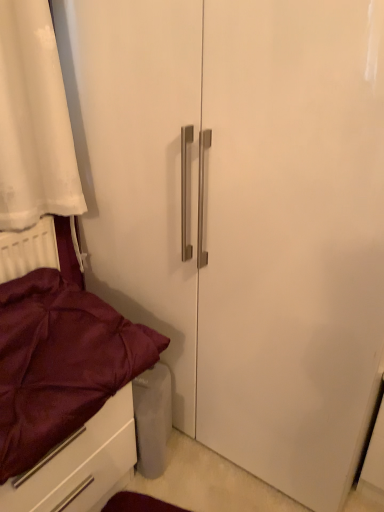
Locate an element on the screen. satin burgundy drawer at lower left is located at coordinates click(80, 464).

The image size is (384, 512). Describe the element at coordinates (80, 464) in the screenshot. I see `satin burgundy drawer at lower left` at that location.

Image resolution: width=384 pixels, height=512 pixels. In order to click on maroon satin bed at lower left in this screenshot , I will do `click(79, 464)`.

Describe the element at coordinates (79, 464) in the screenshot. The width and height of the screenshot is (384, 512). I see `maroon satin bed at lower left` at that location.

Identify the location of satin burgundy drawer at lower left. (80, 464).

Which is more to the right, maroon satin bed at lower left or satin burgundy drawer at lower left?

maroon satin bed at lower left.

Is the position of maroon satin bed at lower left more distant than that of satin burgundy drawer at lower left?

No, the depth of maroon satin bed at lower left is less than that of satin burgundy drawer at lower left.

Is point (132, 405) in front of point (82, 456)?

No, (132, 405) is behind (82, 456).

From the image's perspective, which object appears higher, maroon satin bed at lower left or satin burgundy drawer at lower left?

From the image's view, maroon satin bed at lower left is above.

From a real-world perspective, is maroon satin bed at lower left physically located above or below satin burgundy drawer at lower left?

Clearly, from a real-world perspective, maroon satin bed at lower left is above satin burgundy drawer at lower left.

Considering the relative sizes of maroon satin bed at lower left and satin burgundy drawer at lower left in the image provided, is maroon satin bed at lower left wider than satin burgundy drawer at lower left?

Correct, the width of maroon satin bed at lower left exceeds that of satin burgundy drawer at lower left.

Who is taller, maroon satin bed at lower left or satin burgundy drawer at lower left?

With more height is satin burgundy drawer at lower left.

Looking at the image, does maroon satin bed at lower left seem bigger or smaller compared to satin burgundy drawer at lower left?

In the image, maroon satin bed at lower left appears to be smaller than satin burgundy drawer at lower left.

Would you say maroon satin bed at lower left is outside satin burgundy drawer at lower left?

Yes, maroon satin bed at lower left is not within satin burgundy drawer at lower left.

Is maroon satin bed at lower left placed right next to satin burgundy drawer at lower left?

Yes, maroon satin bed at lower left and satin burgundy drawer at lower left clearly make contact.

Is maroon satin bed at lower left turned away from satin burgundy drawer at lower left?

That's not correct — maroon satin bed at lower left is not looking away from satin burgundy drawer at lower left.

Can you tell me how much maroon satin bed at lower left and satin burgundy drawer at lower left differ in facing direction?

There is a 0.835-degree angle between the facing directions of maroon satin bed at lower left and satin burgundy drawer at lower left.

Locate an element on the screen. The width and height of the screenshot is (384, 512). drawer directly beneath the maroon satin bed at lower left (from a real-world perspective) is located at coordinates (80, 464).

Is satin burgundy drawer at lower left at the left side of maroon satin bed at lower left?

Indeed, satin burgundy drawer at lower left is positioned on the left side of maroon satin bed at lower left.

Which object is further away from the camera, satin burgundy drawer at lower left or maroon satin bed at lower left?

satin burgundy drawer at lower left is behind.

Which point is more forward, (x=25, y=482) or (x=50, y=231)?

The point (x=25, y=482) is closer to the camera.

From the image's perspective, is satin burgundy drawer at lower left beneath maroon satin bed at lower left?

Yes.

From a real-world perspective, is satin burgundy drawer at lower left under maroon satin bed at lower left?

Indeed, from a real-world perspective, satin burgundy drawer at lower left is positioned beneath maroon satin bed at lower left.

In terms of width, does satin burgundy drawer at lower left look wider or thinner when compared to maroon satin bed at lower left?

satin burgundy drawer at lower left is thinner than maroon satin bed at lower left.

Does satin burgundy drawer at lower left have a greater height compared to maroon satin bed at lower left?

Yes, satin burgundy drawer at lower left is taller than maroon satin bed at lower left.

Does satin burgundy drawer at lower left have a larger size compared to maroon satin bed at lower left?

Correct, satin burgundy drawer at lower left is larger in size than maroon satin bed at lower left.

Would you say satin burgundy drawer at lower left contains maroon satin bed at lower left?

No, maroon satin bed at lower left is not surrounded by satin burgundy drawer at lower left.

Would you consider satin burgundy drawer at lower left to be distant from maroon satin bed at lower left?

No, there isn't a large distance between satin burgundy drawer at lower left and maroon satin bed at lower left.

Is satin burgundy drawer at lower left facing towards maroon satin bed at lower left?

No, satin burgundy drawer at lower left does not turn towards maroon satin bed at lower left.

Where is `drawer behind the maroon satin bed at lower left`? This screenshot has height=512, width=384. drawer behind the maroon satin bed at lower left is located at coordinates (80, 464).

The width and height of the screenshot is (384, 512). Identify the location of drawer below the maroon satin bed at lower left (from the image's perspective). (80, 464).

At what (x,y) coordinates should I click in order to perform the action: click on bed that appears on the right of satin burgundy drawer at lower left. Please return your answer as a coordinate pair (x, y). Looking at the image, I should click on (79, 464).